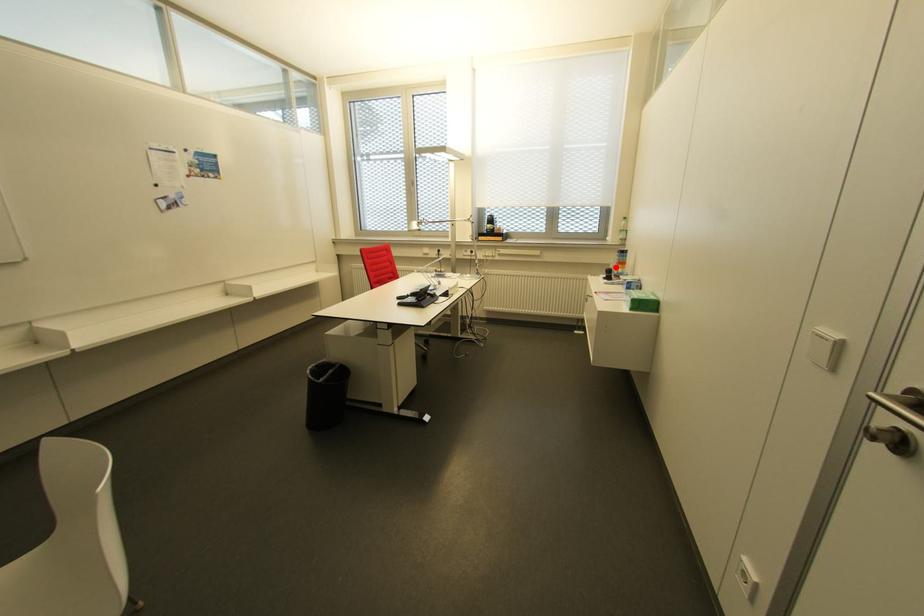
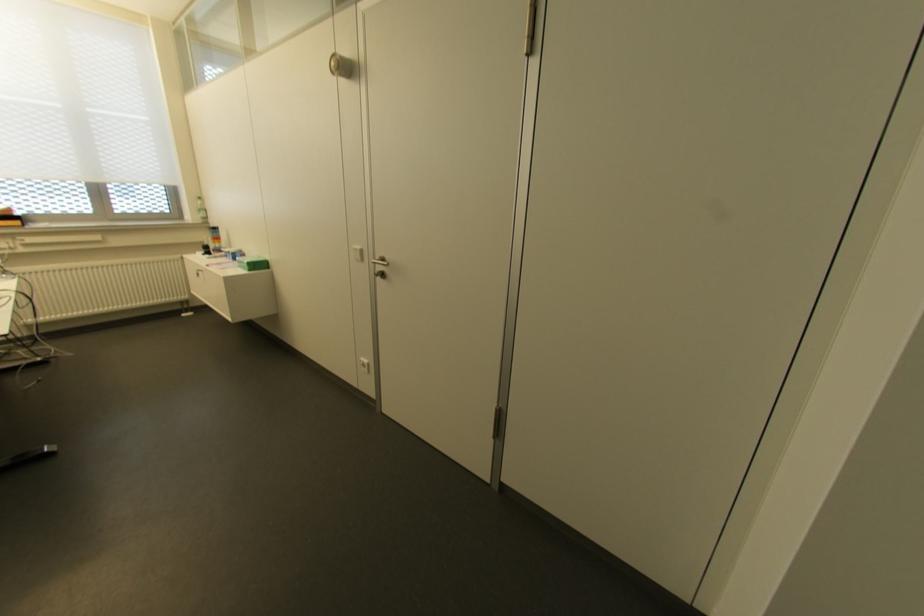
Find the pixel in the second image that matches the highlighted location in the first image.

(213, 243)